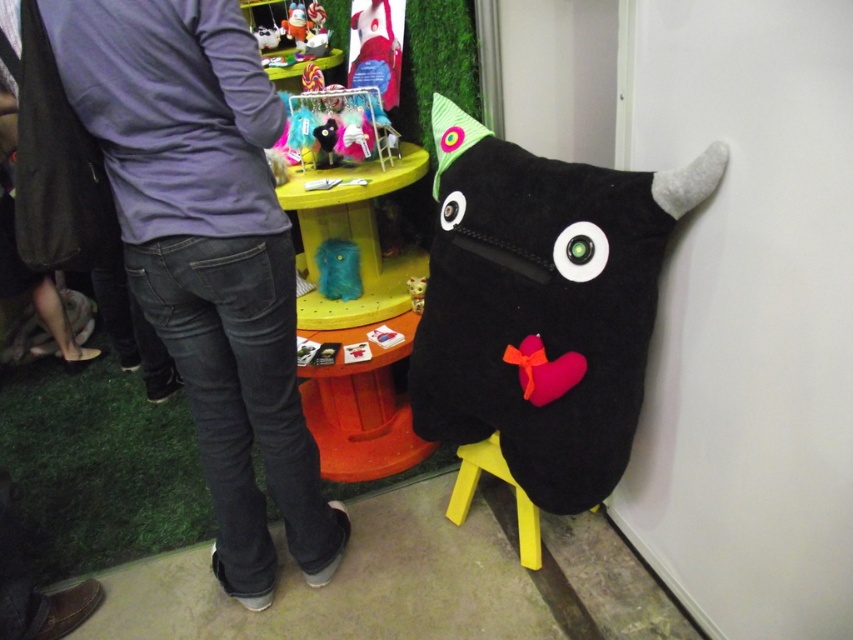
Looking at this image, who is taller, soft plush toy at right or yellow plastic stool at lower center?

Standing taller between the two is soft plush toy at right.

Is soft plush toy at right taller than yellow plastic stool at lower center?

Yes.

Does point (467, 131) lie in front of point (537, 563)?

Yes, point (467, 131) is closer to viewer.

Identify the location of soft plush toy at right. (543, 305).

Which is more to the right, dark denim jeans at lower left or soft plush cat at center?

soft plush cat at center is more to the right.

Can you confirm if dark denim jeans at lower left is thinner than soft plush cat at center?

In fact, dark denim jeans at lower left might be wider than soft plush cat at center.

Who is more distant from viewer, (x=236, y=464) or (x=337, y=138)?

The point (x=337, y=138) is more distant.

I want to click on dark denim jeans at lower left, so click(x=207, y=253).

Which is below, soft plush toy at right or soft plush cat at center?

Positioned lower is soft plush toy at right.

Does point (577, 244) come behind point (329, 122)?

That is False.

This screenshot has height=640, width=853. I want to click on soft plush toy at right, so click(543, 305).

Locate an element on the screen. This screenshot has width=853, height=640. soft plush toy at right is located at coordinates (543, 305).